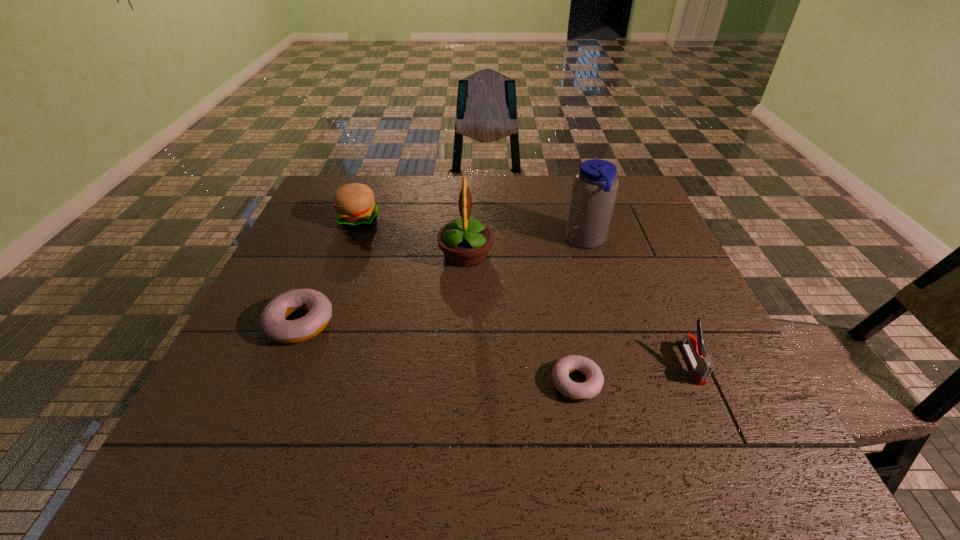
I want to click on free spot located on the face of the sunflower, so click(606, 254).

Find the location of `free space located with a carrying loop on the side of the water bottle`. free space located with a carrying loop on the side of the water bottle is located at coordinates (454, 241).

Locate an element on the screen. The image size is (960, 540). free space located with a carrying loop on the side of the water bottle is located at coordinates (530, 241).

Image resolution: width=960 pixels, height=540 pixels. I want to click on vacant space situated with a carrying loop on the side of the water bottle, so click(x=444, y=241).

Where is `vacant region located 0.330m on the front of the hamburger`? vacant region located 0.330m on the front of the hamburger is located at coordinates (323, 316).

You are a GUI agent. You are given a task and a screenshot of the screen. Output one action in this format:
    pyautogui.click(x=<x>, y=<y>)
    Task: Click on the vacant space situated 0.070m on the handle side of the rightmost object
    The image size is (960, 540).
    Given the screenshot: What is the action you would take?
    pyautogui.click(x=716, y=417)

In order to click on object that is at the far edge in this screenshot , I will do `click(355, 208)`.

The height and width of the screenshot is (540, 960). I want to click on doughnut located at the near edge, so click(x=563, y=367).

Identify the location of stapler that is at the near edge. This screenshot has width=960, height=540. (702, 367).

You are a GUI agent. You are given a task and a screenshot of the screen. Output one action in this format:
    pyautogui.click(x=<x>, y=<y>)
    Task: Click on the doughnut that is at the left edge
    
    Given the screenshot: What is the action you would take?
    pyautogui.click(x=272, y=320)